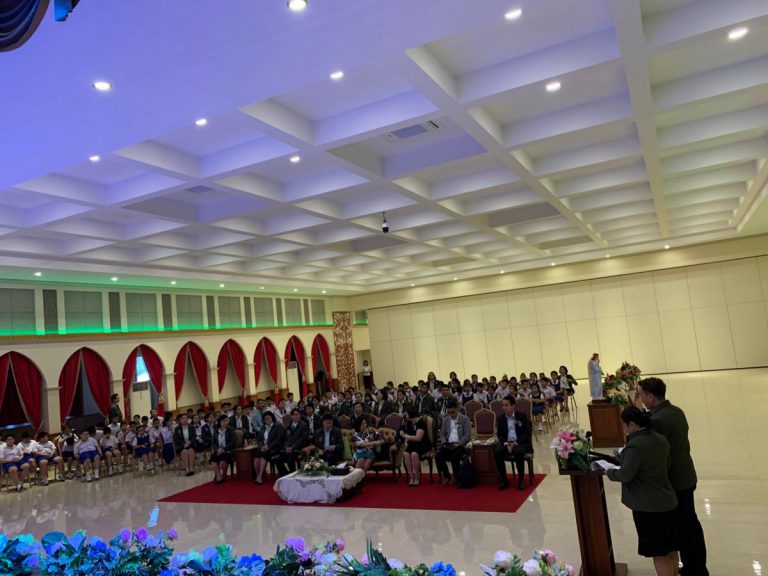
Image resolution: width=768 pixels, height=576 pixels. I want to click on red area rug, so click(x=498, y=499).